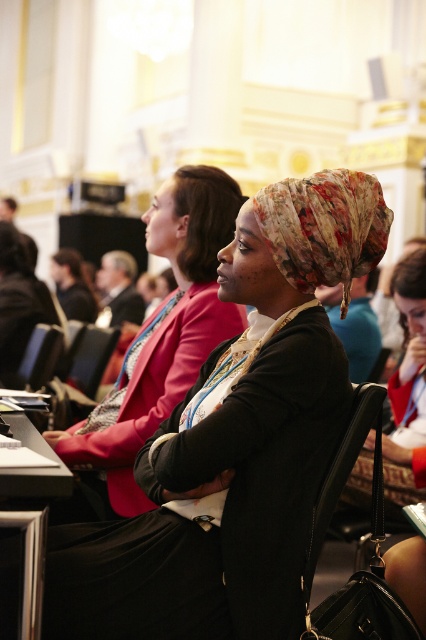
You are a photographer who wants to capture a closeup of the floral fabric headscarf at center without including the black leather chair at center in the frame. Based on their positions, is this possible?

The floral fabric headscarf at center is above the black leather chair at center, so it is possible to capture a closeup of the floral fabric headscarf at center without including the black leather chair at center by focusing on the upper part of the frame.

You are a photographer trying to capture a closeup of the floral fabric headscarf at center and the black leather chair at center. Which object should you zoom in on first to ensure it appears larger in the photo?

The floral fabric headscarf at center is taller than the black leather chair at center, so you should zoom in on the floral fabric headscarf at center first to ensure it appears larger in the photo.

You are standing in the conference room and want to locate the floral fabric headscarf at center. According to the coordinates provided, where exactly is it positioned?

The floral fabric headscarf at center is located at point 0.520 on the x axis and 0.385 on the y axis.